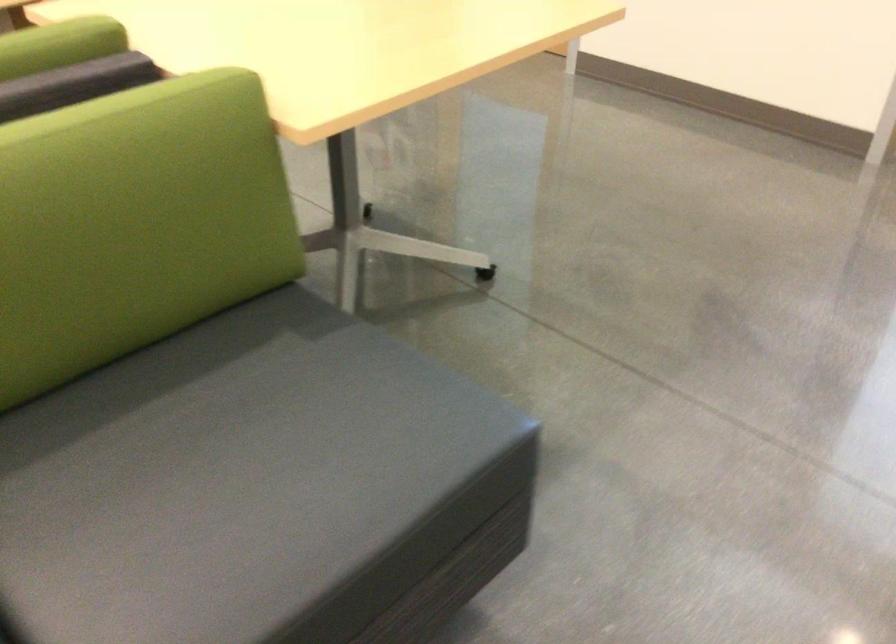
Where would you sit the gray sofa sitting surface? Please return your answer as a coordinate pair (x, y).

(259, 488)